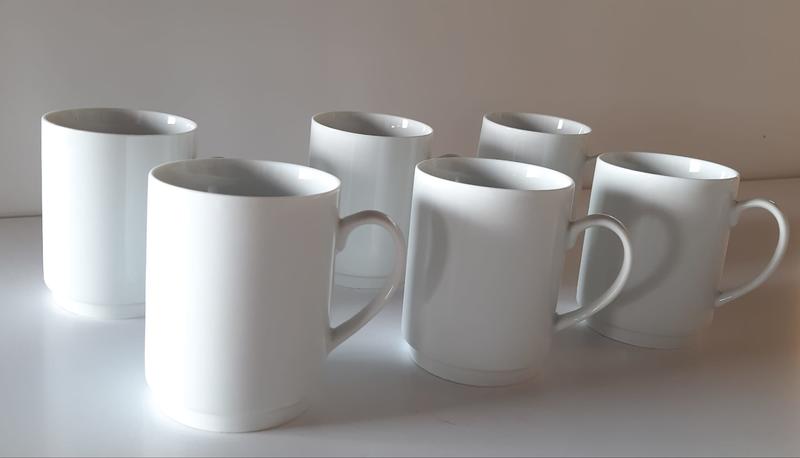
The height and width of the screenshot is (458, 800). In order to click on mugs in this screenshot , I will do `click(93, 152)`, `click(385, 115)`, `click(292, 218)`, `click(468, 193)`, `click(548, 127)`, `click(602, 170)`.